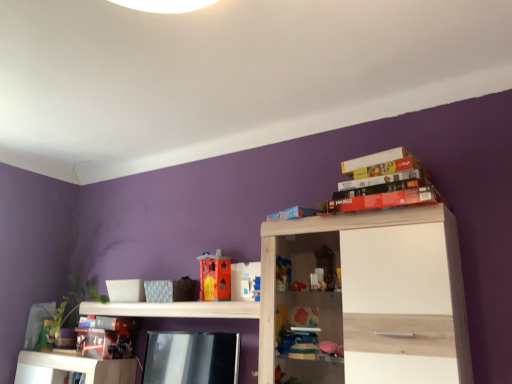
Question: Is white plastic toy at center, which is the third toy in left-to-right order, oriented away from blue matte bookshelf at upper center, which appears as the 2th book when ordered from the bottom?

Choices:
 (A) no
 (B) yes

Answer: (A)

Question: Is blue matte bookshelf at upper center, the 4th book positioned from the top, completely or partially inside white plastic toy at center, which is counted as the 3th toy, starting from the back?

Choices:
 (A) no
 (B) yes

Answer: (A)

Question: Considering the relative sizes of white plastic toy at center, arranged as the 2th toy when viewed from the top, and blue matte bookshelf at upper center, which appears as the 2th book when ordered from the bottom, in the image provided, is white plastic toy at center, arranged as the 2th toy when viewed from the top, shorter than blue matte bookshelf at upper center, which appears as the 2th book when ordered from the bottom,?

Choices:
 (A) yes
 (B) no

Answer: (B)

Question: Is white plastic toy at center, which appears as the 2th toy when ordered from the bottom, bigger than blue matte bookshelf at upper center, which appears as the 2th book when ordered from the bottom?

Choices:
 (A) yes
 (B) no

Answer: (B)

Question: Is white plastic toy at center, which is counted as the 3th toy, starting from the back, located outside blue matte bookshelf at upper center, the 4th book positioned from the top?

Choices:
 (A) yes
 (B) no

Answer: (A)

Question: Is white plastic toy at center, which is counted as the 3th toy, starting from the back, taller than blue matte bookshelf at upper center, which appears as the 2th book when ordered from the bottom?

Choices:
 (A) no
 (B) yes

Answer: (B)

Question: Considering the relative sizes of white plastic toy at center, positioned as the first toy in front-to-back order, and matte red lego box at upper right, which is the third book in bottom-to-top order, in the image provided, is white plastic toy at center, positioned as the first toy in front-to-back order, bigger than matte red lego box at upper right, which is the third book in bottom-to-top order,?

Choices:
 (A) yes
 (B) no

Answer: (B)

Question: Can you confirm if white plastic toy at center, which appears as the 2th toy when ordered from the bottom, is taller than matte red lego box at upper right, which is the third book in bottom-to-top order?

Choices:
 (A) no
 (B) yes

Answer: (B)

Question: Does white plastic toy at center, which is counted as the 3th toy, starting from the back, have a lesser width compared to matte red lego box at upper right, the 3th book from the top?

Choices:
 (A) no
 (B) yes

Answer: (B)

Question: Can you confirm if white plastic toy at center, arranged as the 2th toy when viewed from the top, is positioned to the right of matte red lego box at upper right, the 3th book from the top?

Choices:
 (A) no
 (B) yes

Answer: (A)

Question: Can you confirm if white plastic toy at center, arranged as the 2th toy when viewed from the top, is positioned to the left of matte red lego box at upper right, which is the third book in bottom-to-top order?

Choices:
 (A) no
 (B) yes

Answer: (B)

Question: Is white plastic toy at center, which is counted as the 3th toy, starting from the back, shorter than matte red lego box at upper right, which is the third book in bottom-to-top order?

Choices:
 (A) yes
 (B) no

Answer: (B)

Question: Is matte cardboard book at upper right, which ranks as the fifth book in bottom-to-top order, positioned before plastic toy castle at center, which appears as the second toy when viewed from the back?

Choices:
 (A) yes
 (B) no

Answer: (A)